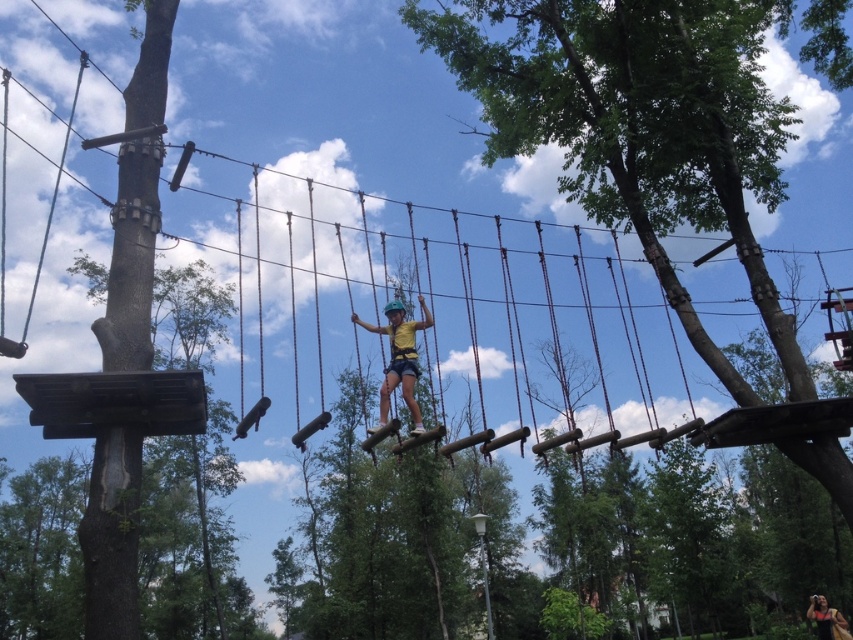
Question: Which point is farther to the camera?

Choices:
 (A) (579, 93)
 (B) (383, 412)

Answer: (A)

Question: Which object appears farthest from the camera in this image?

Choices:
 (A) green wood tree at upper center
 (B) brown wood pole at left
 (C) matte yellow shirt at center
 (D) yellow fabric harness at center

Answer: (C)

Question: Where is yellow fabric harness at center located in relation to matte yellow shirt at center in the image?

Choices:
 (A) below
 (B) above

Answer: (B)

Question: In this image, where is green wood tree at upper center located relative to brown wood pole at left?

Choices:
 (A) below
 (B) above

Answer: (B)

Question: Can you confirm if green wood tree at upper center is positioned to the left of brown wood pole at left?

Choices:
 (A) no
 (B) yes

Answer: (A)

Question: Which object is the farthest from the matte yellow shirt at center?

Choices:
 (A) yellow fabric harness at center
 (B) brown wood pole at left
 (C) green wood tree at upper center

Answer: (B)